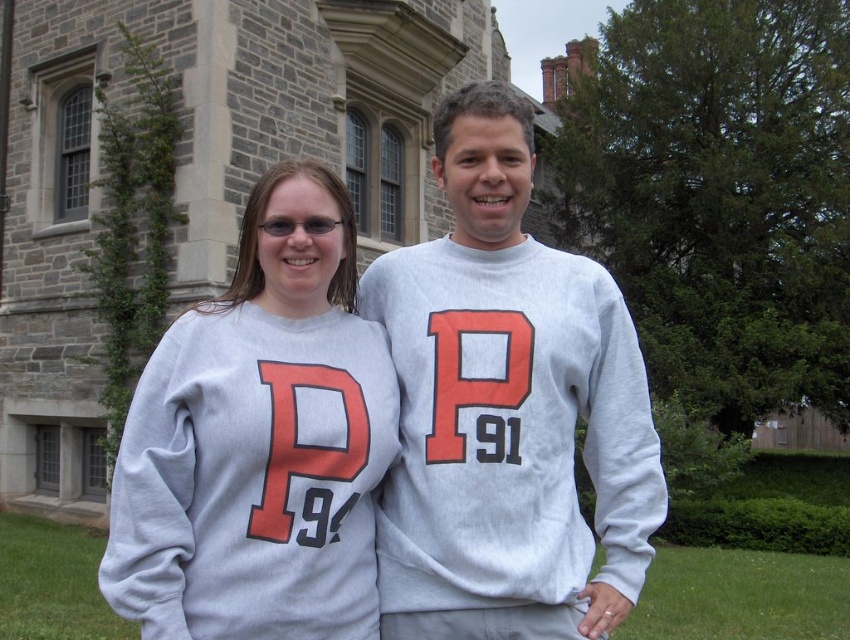
Question: Which of the following is the farthest from the observer?

Choices:
 (A) (336, 477)
 (B) (425, 609)

Answer: (B)

Question: Is gray cotton sweatshirt at center to the right of gray sweatshirt at center from the viewer's perspective?

Choices:
 (A) yes
 (B) no

Answer: (A)

Question: Which object appears closest to the camera in this image?

Choices:
 (A) gray sweatshirt at center
 (B) gray cotton sweatshirt at center

Answer: (A)

Question: Which of the following is the farthest from the observer?

Choices:
 (A) (340, 198)
 (B) (480, 516)

Answer: (A)

Question: From the image, what is the correct spatial relationship of gray cotton sweatshirt at center in relation to gray sweatshirt at center?

Choices:
 (A) above
 (B) below

Answer: (A)

Question: Does gray cotton sweatshirt at center appear under gray sweatshirt at center?

Choices:
 (A) yes
 (B) no

Answer: (B)